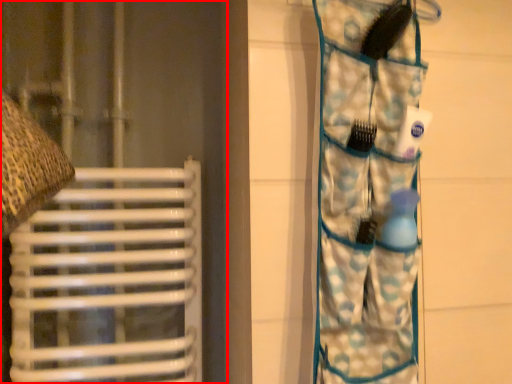
Question: Observing the image, what is the correct spatial positioning of curtain (annotated by the red box) in reference to camouflage?

Choices:
 (A) right
 (B) left

Answer: (B)